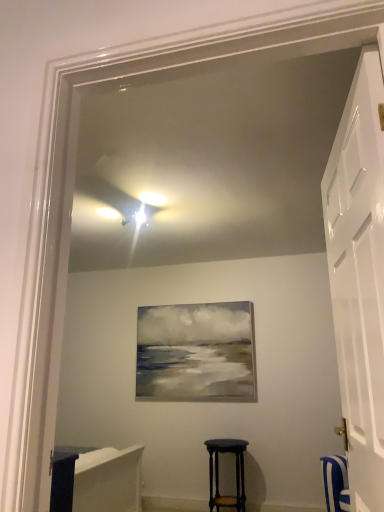
Question: Is white glossy door at right thinner than dark wood stool at center?

Choices:
 (A) yes
 (B) no

Answer: (A)

Question: Is white glossy door at right positioned behind dark wood stool at center?

Choices:
 (A) no
 (B) yes

Answer: (A)

Question: From a real-world perspective, is white glossy door at right located higher than dark wood stool at center?

Choices:
 (A) no
 (B) yes

Answer: (B)

Question: Is white glossy door at right outside of dark wood stool at center?

Choices:
 (A) no
 (B) yes

Answer: (B)

Question: Can you confirm if white glossy door at right is smaller than dark wood stool at center?

Choices:
 (A) no
 (B) yes

Answer: (A)

Question: Considering the relative sizes of white glossy door at right and dark wood stool at center in the image provided, is white glossy door at right bigger than dark wood stool at center?

Choices:
 (A) yes
 (B) no

Answer: (A)

Question: From a real-world perspective, does dark wood stool at center sit lower than white glossy door at right?

Choices:
 (A) no
 (B) yes

Answer: (B)

Question: Is dark wood stool at center not within white glossy door at right?

Choices:
 (A) yes
 (B) no

Answer: (A)

Question: Is dark wood stool at center closer to camera compared to white glossy door at right?

Choices:
 (A) yes
 (B) no

Answer: (B)

Question: Is dark wood stool at center next to white glossy door at right?

Choices:
 (A) no
 (B) yes

Answer: (A)

Question: From a real-world perspective, is dark wood stool at center physically above white glossy door at right?

Choices:
 (A) yes
 (B) no

Answer: (B)

Question: From the image's perspective, does dark wood stool at center appear lower than white glossy door at right?

Choices:
 (A) no
 (B) yes

Answer: (B)

Question: Relative to dark wood stool at center, is white glossy door at right in front or behind?

Choices:
 (A) front
 (B) behind

Answer: (A)